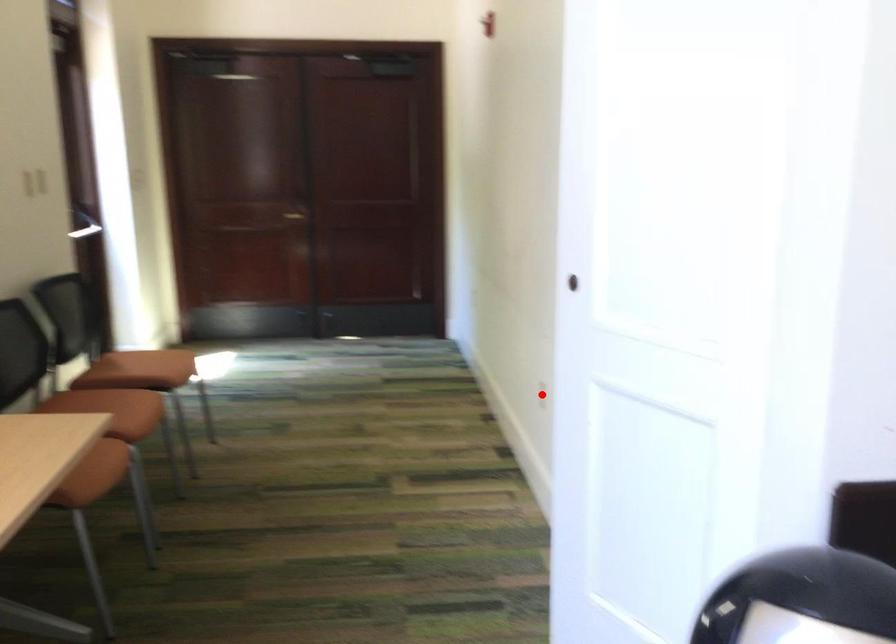
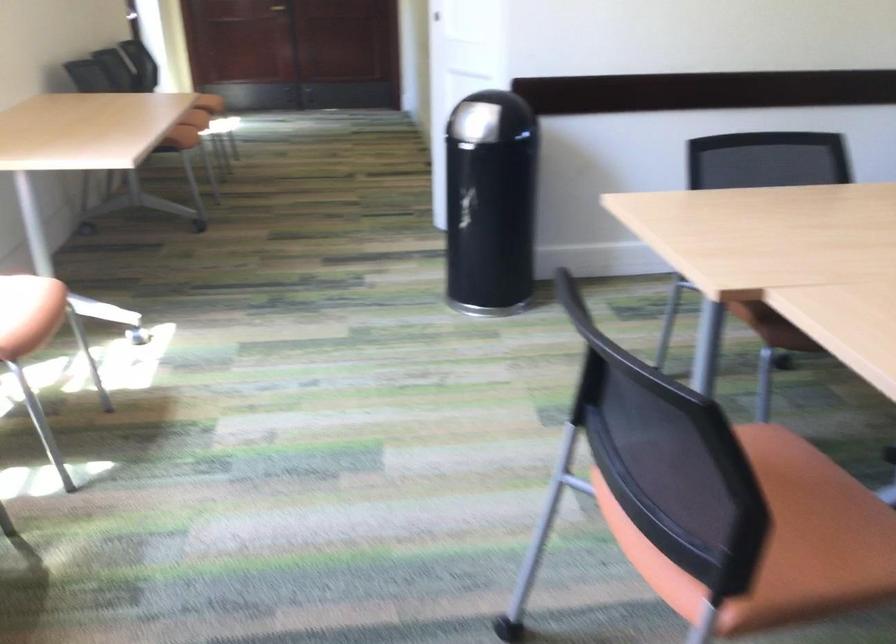
Question: I am providing you with two images of the same scene from different viewpoints. A red point is marked on the first image. Can you still see the location of the red point in image 2?

Choices:
 (A) Yes
 (B) No

Answer: (B)